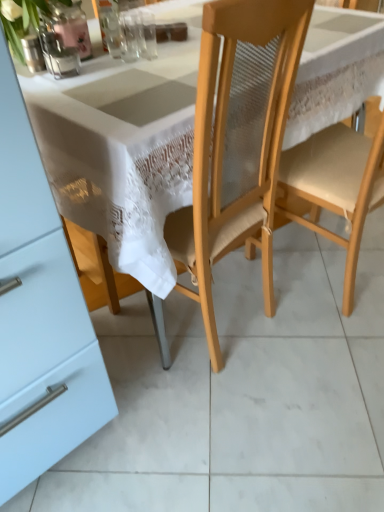
The height and width of the screenshot is (512, 384). I want to click on free space behind transparent glass at upper center, arranged as the first tableware when viewed from the right, so click(x=141, y=42).